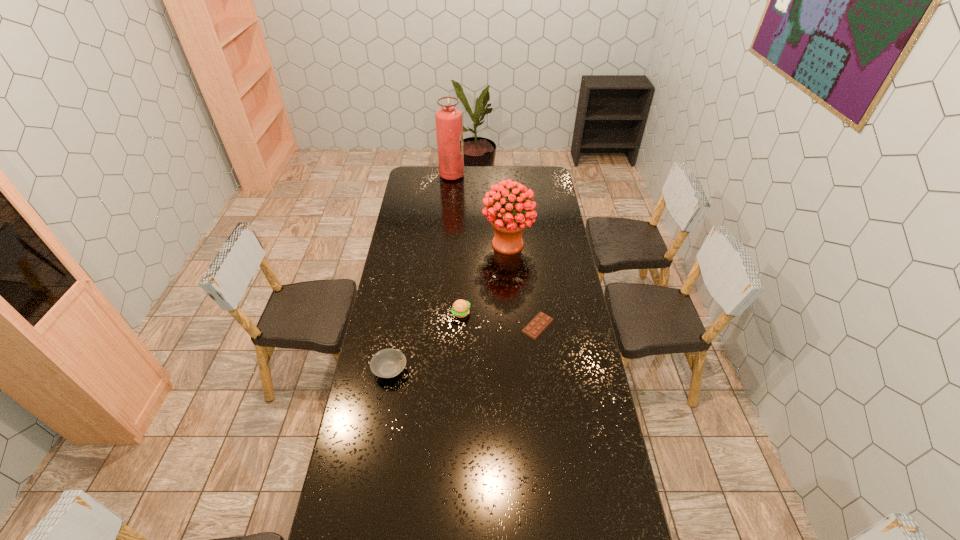
Image resolution: width=960 pixels, height=540 pixels. I want to click on object identified as the fourth closest to the fire extinguisher, so click(x=387, y=363).

Locate an element on the screen. object that is the third nearest to the shortest object is located at coordinates (387, 363).

Where is `free point that satisfies the following two spatial constraints: 1. on the back side of the shortest object; 2. on the label side of the tallest object`? free point that satisfies the following two spatial constraints: 1. on the back side of the shortest object; 2. on the label side of the tallest object is located at coordinates (519, 176).

Locate an element on the screen. This screenshot has height=540, width=960. blank space that satisfies the following two spatial constraints: 1. on the label side of the hamburger; 2. on the left side of the tallest object is located at coordinates (440, 313).